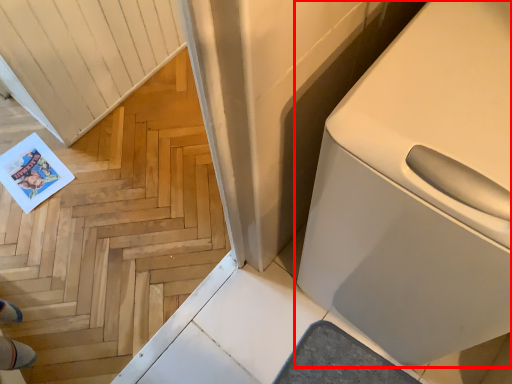
Question: From the image's perspective, what is the correct spatial positioning of home appliance (annotated by the red box) in reference to stairwell?

Choices:
 (A) above
 (B) below

Answer: (A)